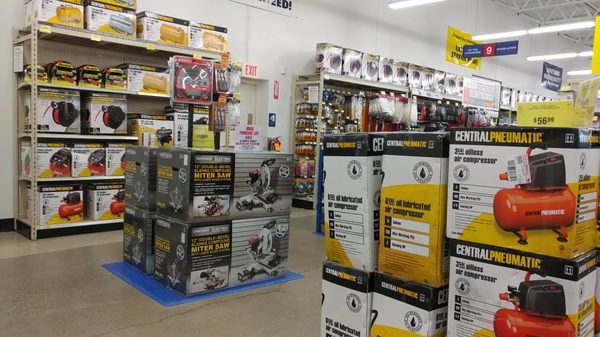
The width and height of the screenshot is (600, 337). Find the location of `lights`. lights is located at coordinates (533, 31), (562, 53), (576, 71), (403, 3).